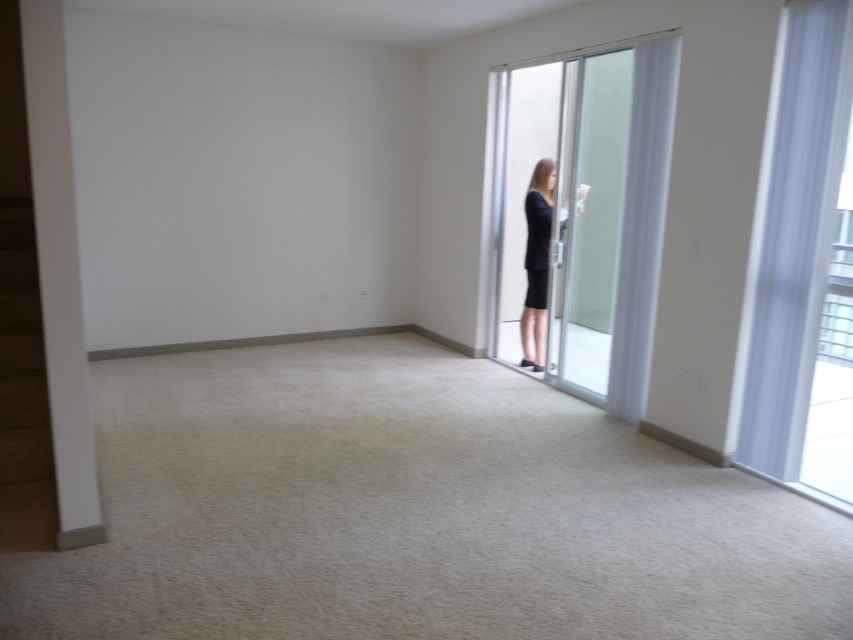
Question: Which point is farther from the camera taking this photo?

Choices:
 (A) (529, 356)
 (B) (802, 154)

Answer: (A)

Question: Is transparent fabric curtain at right wider than clear glass screen door at right?

Choices:
 (A) no
 (B) yes

Answer: (B)

Question: Is transparent fabric curtain at right closer to camera compared to clear glass screen door at right?

Choices:
 (A) no
 (B) yes

Answer: (B)

Question: Which object is the closest to the black matte dress at center?

Choices:
 (A) transparent fabric curtain at right
 (B) clear glass screen door at right

Answer: (B)

Question: Which object appears closest to the camera in this image?

Choices:
 (A) clear glass screen door at right
 (B) transparent fabric curtain at right
 (C) black matte dress at center

Answer: (B)

Question: Does transparent fabric curtain at right appear under clear glass screen door at right?

Choices:
 (A) no
 (B) yes

Answer: (B)